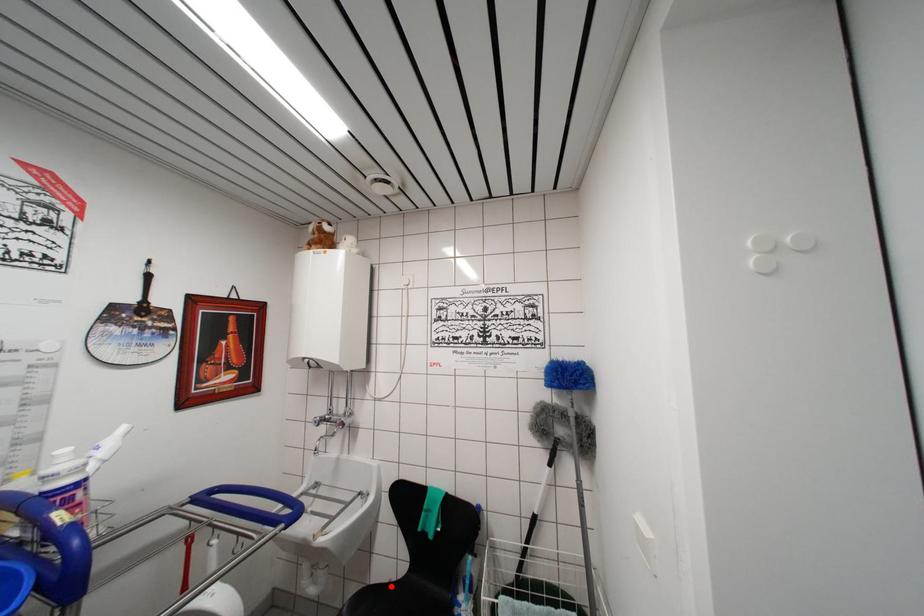
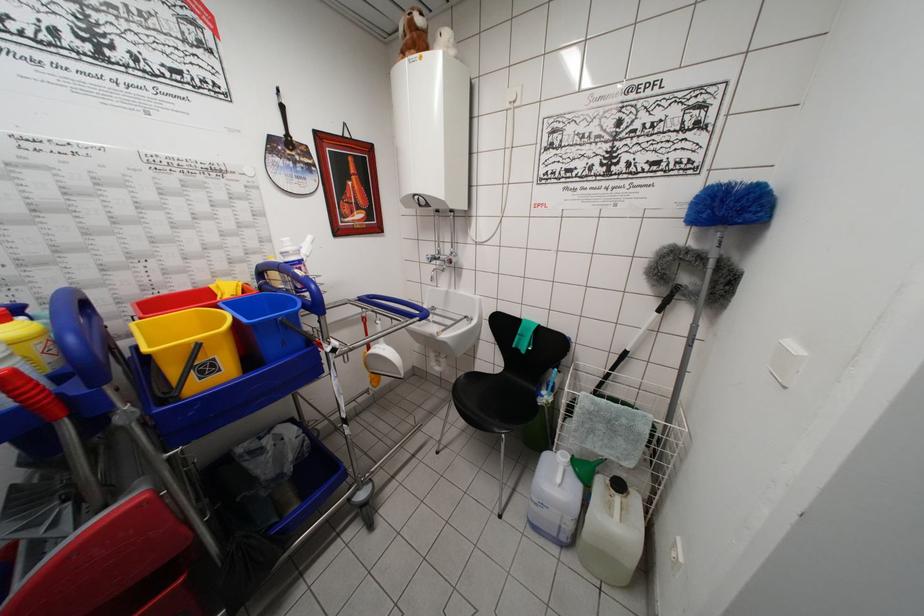
Find the pixel in the second image that matches the highlighted location in the first image.

(491, 379)